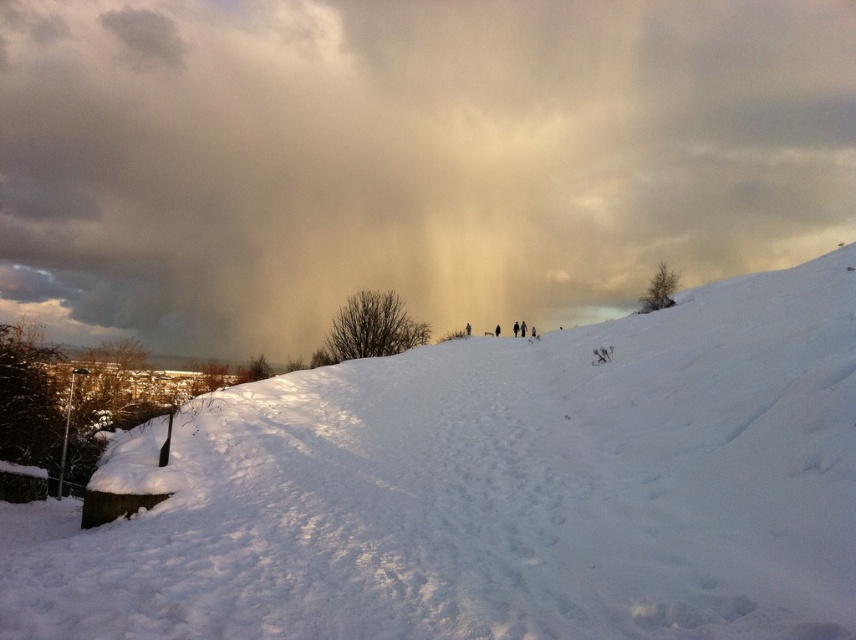
You are standing at the camera position and want to reach the point marked at coordinates (274, 195) in the image. Given that the distance between you and this point is 658.09 meters, would you need to walk more than a kilometer to get there?

The distance between you and the point marked at coordinates (274, 195) is 658.09 meters, which is less than a kilometer. Therefore, you would not need to walk more than a kilometer to reach it.

You are standing at the bottom of the snow slope and looking up. There is a point marked at coordinates (406,157). What does this point represent?

The point at coordinates (406,157) corresponds to the cloudy sky at upper center.

You are standing on the snow at center and looking up. Which object, the cloudy sky at upper center or the white fluffy snow at center, appears closer to you?

The cloudy sky at upper center appears closer to you because it is further to the viewer than the white fluffy snow at center.